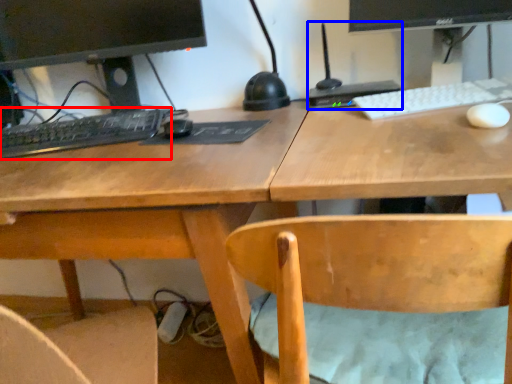
Question: Which object is closer to the camera taking this photo, computer keyboard (highlighted by a red box) or computer (highlighted by a blue box)?

Choices:
 (A) computer keyboard
 (B) computer

Answer: (A)